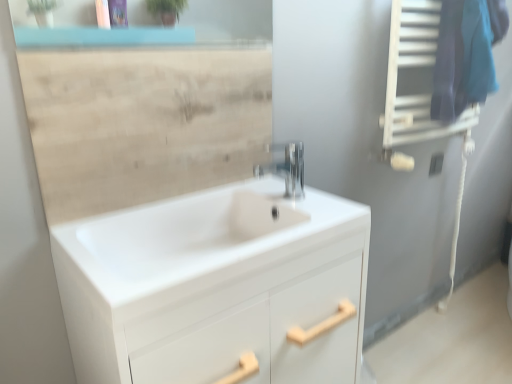
In order to face polished chrome faucet at center, should I rotate leftwards or rightwards?

You should rotate right by 3.147 degrees.

Image resolution: width=512 pixels, height=384 pixels. Describe the element at coordinates (286, 167) in the screenshot. I see `polished chrome faucet at center` at that location.

Identify the location of white glossy cabinet at center. (214, 279).

You are a GUI agent. You are given a task and a screenshot of the screen. Output one action in this format:
    pyautogui.click(x=<x>, y=<y>)
    Task: Click on the blue fabric at upper right
    Image resolution: width=512 pixels, height=384 pixels.
    Given the screenshot: What is the action you would take?
    pyautogui.click(x=466, y=54)

This screenshot has width=512, height=384. I want to click on polished chrome faucet at center, so click(286, 167).

Image resolution: width=512 pixels, height=384 pixels. I want to click on tap behind the beige wood mirror at upper center, so click(286, 167).

Is point (296, 184) closer or farther from the camera than point (63, 104)?

Point (296, 184).

In terms of width, does polished chrome faucet at center look wider or thinner when compared to beige wood mirror at upper center?

polished chrome faucet at center is wider than beige wood mirror at upper center.

How different are the orientations of polished chrome faucet at center and beige wood mirror at upper center in degrees?

There is a 90.4-degree angle between the facing directions of polished chrome faucet at center and beige wood mirror at upper center.

Between blue fabric at upper right and white glossy cabinet at center, which one has smaller width?

blue fabric at upper right.

Is blue fabric at upper right to the right of white glossy cabinet at center from the viewer's perspective?

Indeed, blue fabric at upper right is positioned on the right side of white glossy cabinet at center.

Is blue fabric at upper right further to camera compared to white glossy cabinet at center?

Yes.

Are blue fabric at upper right and white glossy cabinet at center making contact?

blue fabric at upper right and white glossy cabinet at center are not in contact.

Looking at this image, is blue fabric at upper right positioned behind beige wood mirror at upper center?

Yes, blue fabric at upper right is further from the camera.

From the image's perspective, which object appears higher, blue fabric at upper right or beige wood mirror at upper center?

From the image's view, blue fabric at upper right is above.

Is blue fabric at upper right to the left or to the right of beige wood mirror at upper center in the image?

Clearly, blue fabric at upper right is on the right of beige wood mirror at upper center in the image.

From the image's perspective, which is above, beige wood mirror at upper center or blue fabric at upper right?

From the image's view, blue fabric at upper right is above.

Considering the relative positions of beige wood mirror at upper center and blue fabric at upper right in the image provided, is beige wood mirror at upper center in front of blue fabric at upper right?

Yes, it is.

From a real-world perspective, which is physically above, beige wood mirror at upper center or blue fabric at upper right?

blue fabric at upper right.

Based on the photo, considering the relative sizes of blue fabric at upper right and polished chrome faucet at center in the image provided, is blue fabric at upper right shorter than polished chrome faucet at center?

In fact, blue fabric at upper right may be taller than polished chrome faucet at center.

Is point (462, 76) positioned behind point (289, 185)?

Yes, it is.

Considering the sizes of objects blue fabric at upper right and polished chrome faucet at center in the image provided, who is bigger, blue fabric at upper right or polished chrome faucet at center?

Bigger between the two is blue fabric at upper right.

How much distance is there between blue fabric at upper right and polished chrome faucet at center?

blue fabric at upper right and polished chrome faucet at center are 65.16 centimeters apart from each other.

Would you say blue fabric at upper right is part of polished chrome faucet at center's contents?

No, blue fabric at upper right is not a part of polished chrome faucet at center.

Who is smaller, polished chrome faucet at center or blue fabric at upper right?

polished chrome faucet at center.

Find the location of a particular element. tap lying on the left of blue fabric at upper right is located at coordinates (286, 167).

Is the position of polished chrome faucet at center more distant than that of white glossy cabinet at center?

Yes, polished chrome faucet at center is further from the camera.

How different are the orientations of polished chrome faucet at center and white glossy cabinet at center in degrees?

90 degrees.

From a real-world perspective, which is physically above, polished chrome faucet at center or white glossy cabinet at center?

polished chrome faucet at center is physically above.

Looking at this image, is polished chrome faucet at center far away from white glossy cabinet at center?

polished chrome faucet at center is near white glossy cabinet at center, not far away.

This screenshot has height=384, width=512. Find the location of `tap that is below the beige wood mirror at upper center (from the image's perspective)`. tap that is below the beige wood mirror at upper center (from the image's perspective) is located at coordinates coord(286,167).

The width and height of the screenshot is (512, 384). In order to click on laundry above the white glossy cabinet at center (from the image's perspective) in this screenshot , I will do click(x=466, y=54).

Considering their positions, is polished chrome faucet at center positioned closer to blue fabric at upper right than white glossy cabinet at center?

polished chrome faucet at center.

Estimate the real-world distances between objects in this image. Which object is further from beige wood mirror at upper center, blue fabric at upper right or white glossy cabinet at center?

Among the two, blue fabric at upper right is located further to beige wood mirror at upper center.

When comparing their distances from blue fabric at upper right, does white glossy cabinet at center or beige wood mirror at upper center seem closer?

beige wood mirror at upper center is closer to blue fabric at upper right.

From the image, which object appears to be farther from polished chrome faucet at center, blue fabric at upper right or white glossy cabinet at center?

The object further to polished chrome faucet at center is blue fabric at upper right.

When comparing their distances from blue fabric at upper right, does polished chrome faucet at center or beige wood mirror at upper center seem closer?

Based on the image, polished chrome faucet at center appears to be nearer to blue fabric at upper right.

From the picture: Which object lies further to the anchor point beige wood mirror at upper center, polished chrome faucet at center or blue fabric at upper right?

blue fabric at upper right.

In the scene shown: Looking at the image, which one is located closer to polished chrome faucet at center, white glossy cabinet at center or beige wood mirror at upper center?

The object closer to polished chrome faucet at center is beige wood mirror at upper center.

Considering their positions, is beige wood mirror at upper center positioned closer to white glossy cabinet at center than blue fabric at upper right?

Based on the image, beige wood mirror at upper center appears to be nearer to white glossy cabinet at center.

Locate an element on the screen. Image resolution: width=512 pixels, height=384 pixels. bathroom cabinet located between beige wood mirror at upper center and blue fabric at upper right in the left-right direction is located at coordinates (214, 279).

Identify the location of tap situated between beige wood mirror at upper center and blue fabric at upper right from left to right. The image size is (512, 384). (286, 167).

What are the coordinates of `tap between beige wood mirror at upper center and white glossy cabinet at center in the up-down direction` in the screenshot? It's located at (286, 167).

Identify the location of tap between white glossy cabinet at center and blue fabric at upper right from left to right. The image size is (512, 384). (286, 167).